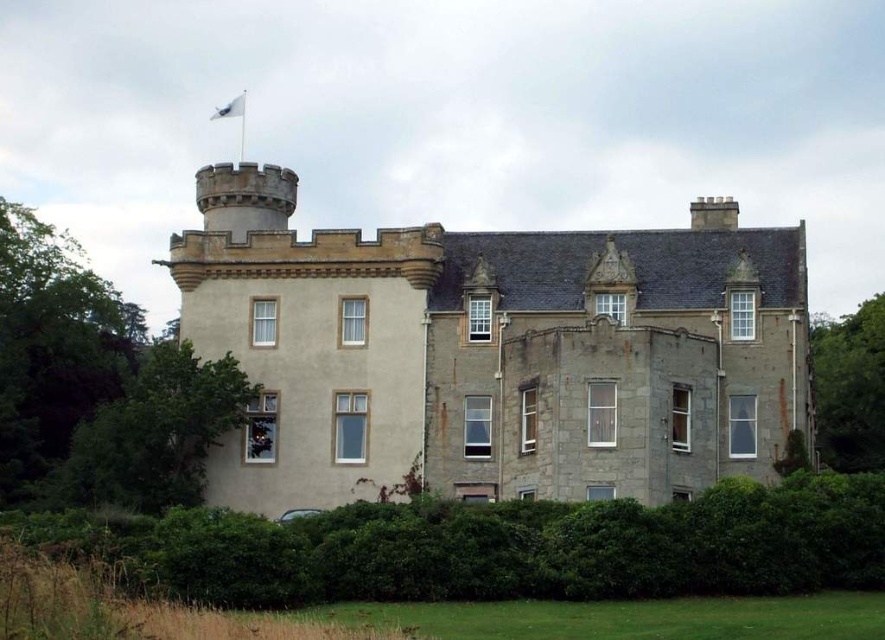
Who is more distant from viewer, (x=850, y=573) or (x=824, y=400)?

The point (x=824, y=400) is behind.

Which is in front, point (645, 524) or point (867, 337)?

Positioned in front is point (645, 524).

Identify the location of green leafy hedge at lower center. (496, 547).

Who is taller, green leafy tree at left or white fabric flag at upper center?

Standing taller between the two is green leafy tree at left.

Image resolution: width=885 pixels, height=640 pixels. I want to click on green leafy tree at left, so click(x=96, y=385).

Find the location of `green leafy tree at left`. green leafy tree at left is located at coordinates (96, 385).

Where is `green leafy tree at lower left`? The height and width of the screenshot is (640, 885). green leafy tree at lower left is located at coordinates (155, 433).

Locate an element on the screen. green leafy tree at lower left is located at coordinates (155, 433).